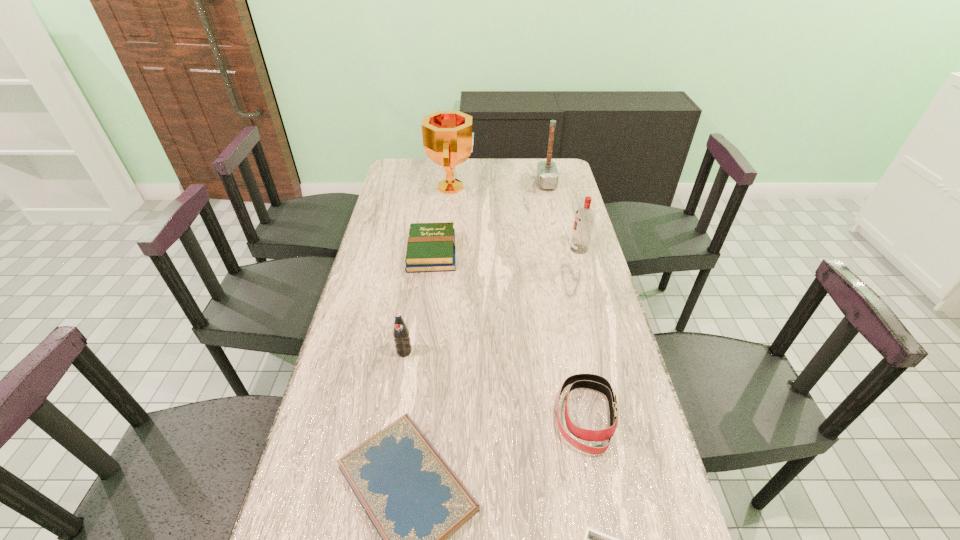
Find the location of a particular element. This screenshot has width=960, height=540. vacant space located 0.320m on the striking surface of the hammer is located at coordinates (466, 183).

This screenshot has height=540, width=960. I want to click on blank space located 0.220m on the striking surface of the hammer, so click(488, 183).

You are a GUI agent. You are given a task and a screenshot of the screen. Output one action in this format:
    pyautogui.click(x=<x>, y=<y>)
    Task: Click on the free space located 0.080m on the front label of the vodka
    
    Given the screenshot: What is the action you would take?
    pyautogui.click(x=548, y=249)

In order to click on vacant region located 0.340m on the front label of the vodka in this screenshot , I will do `click(477, 249)`.

You are a GUI agent. You are given a task and a screenshot of the screen. Output one action in this format:
    pyautogui.click(x=<x>, y=<y>)
    Task: Click on the vacant position located 0.340m on the front label of the vodka
    The height and width of the screenshot is (540, 960).
    Given the screenshot: What is the action you would take?
    pyautogui.click(x=477, y=249)

Locate an element on the screen. The width and height of the screenshot is (960, 540). free space located 0.060m on the front label of the pop is located at coordinates (400, 375).

You are a GUI agent. You are given a task and a screenshot of the screen. Output one action in this format:
    pyautogui.click(x=<x>, y=<y>)
    Task: Click on the free space located 0.130m on the back of the dog collar
    Image resolution: width=960 pixels, height=540 pixels.
    Given the screenshot: What is the action you would take?
    pyautogui.click(x=572, y=343)

This screenshot has width=960, height=540. I want to click on vacant space situated on the back of the left book, so click(x=441, y=181).

The width and height of the screenshot is (960, 540). Identify the location of award that is at the far edge. (448, 140).

Locate an element on the screen. hammer located at the far edge is located at coordinates (547, 174).